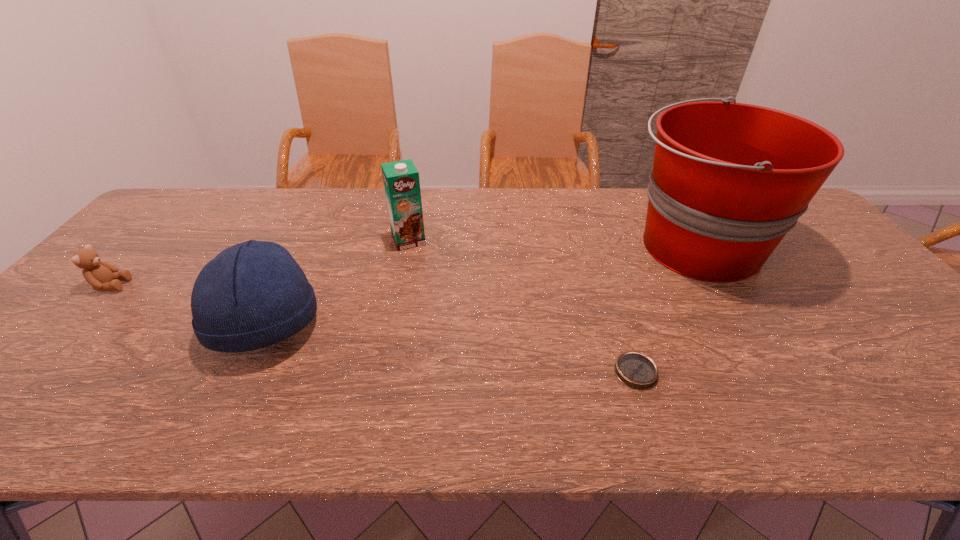
This screenshot has height=540, width=960. Identify the location of free space located 0.340m on the left of the bucket. (508, 246).

Where is `vacant position located on the front of the fourth shortest object`? This screenshot has height=540, width=960. vacant position located on the front of the fourth shortest object is located at coordinates (400, 278).

You are a GUI agent. You are given a task and a screenshot of the screen. Output one action in this format:
    pyautogui.click(x=<x>, y=<y>)
    Task: Click on the vacant area situated 0.090m on the front of the skullcap
    This screenshot has width=960, height=540.
    Given the screenshot: What is the action you would take?
    pyautogui.click(x=226, y=406)

Locate an element on the screen. This screenshot has width=960, height=540. vacant space located on the front-facing side of the second shortest object is located at coordinates (165, 285).

At what (x,y) coordinates should I click in order to perform the action: click on free space located on the left of the compass. Please return your answer as a coordinate pair (x, y). Looking at the image, I should click on (546, 372).

Image resolution: width=960 pixels, height=540 pixels. Identify the location of object located at the far edge. (729, 180).

This screenshot has width=960, height=540. Find the location of `object that is at the left edge`. object that is at the left edge is located at coordinates (102, 276).

The image size is (960, 540). I want to click on blank space at the far edge of the desktop, so click(x=561, y=194).

Locate an element on the screen. The image size is (960, 540). free region at the near edge of the desktop is located at coordinates (138, 426).

The image size is (960, 540). In the image, there is a desktop. Find the location of `free space at the left edge`. free space at the left edge is located at coordinates (173, 241).